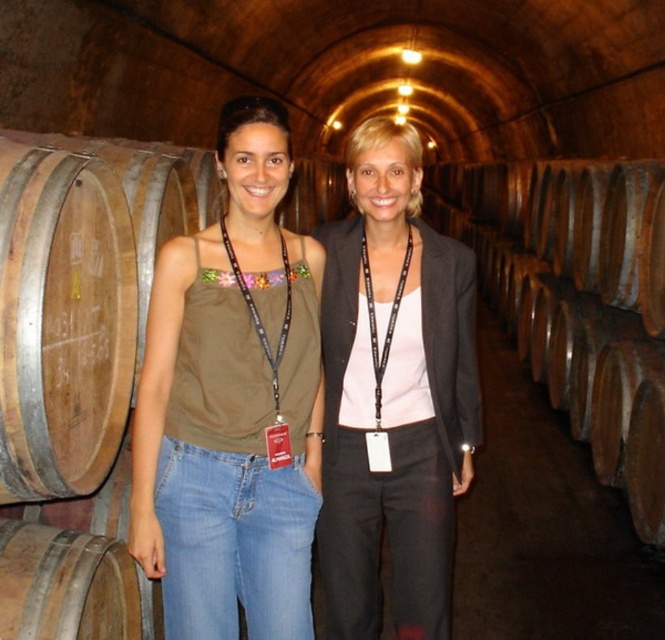
Question: Where is matte brown tank top at center located in relation to matte black blazer at center in the image?

Choices:
 (A) above
 (B) below

Answer: (A)

Question: Which point appears closest to the camera in this image?

Choices:
 (A) (352, 390)
 (B) (287, 454)

Answer: (B)

Question: Which point is farther to the camera?

Choices:
 (A) (196, 620)
 (B) (448, 417)

Answer: (B)

Question: Does matte brown tank top at center appear on the left side of matte black blazer at center?

Choices:
 (A) yes
 (B) no

Answer: (A)

Question: Where is matte brown tank top at center located in relation to matte black blazer at center in the image?

Choices:
 (A) right
 (B) left

Answer: (B)